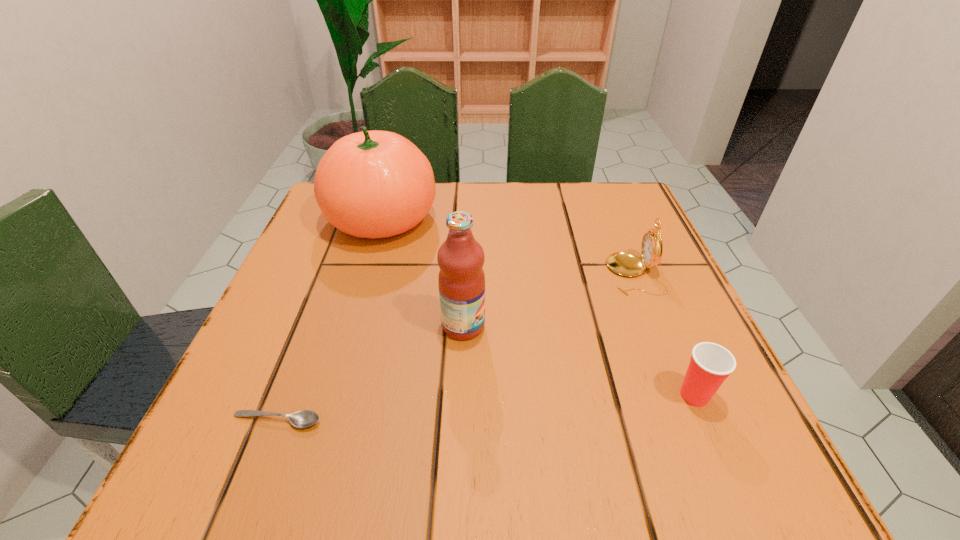
Find the location of a particular element. free space in the image that satisfies the following two spatial constraints: 1. on the back side of the fourth tallest object; 2. on the right side of the soupspoon is located at coordinates (286, 395).

The image size is (960, 540). In order to click on vacant position in the image that satisfies the following two spatial constraints: 1. on the front label of the third object from left to right; 2. on the back side of the fourth tallest object in this screenshot , I will do `click(461, 395)`.

Find the location of a particular element. vacant space that satisfies the following two spatial constraints: 1. on the face of the second farthest object; 2. on the left side of the Dixie cup is located at coordinates (684, 395).

Where is `free space that satisfies the following two spatial constraints: 1. on the face of the third shortest object; 2. on the right side of the second shortest object`? The width and height of the screenshot is (960, 540). free space that satisfies the following two spatial constraints: 1. on the face of the third shortest object; 2. on the right side of the second shortest object is located at coordinates (684, 395).

This screenshot has width=960, height=540. I want to click on free space that satisfies the following two spatial constraints: 1. on the face of the Dixie cup; 2. on the right side of the pocket watch, so click(684, 395).